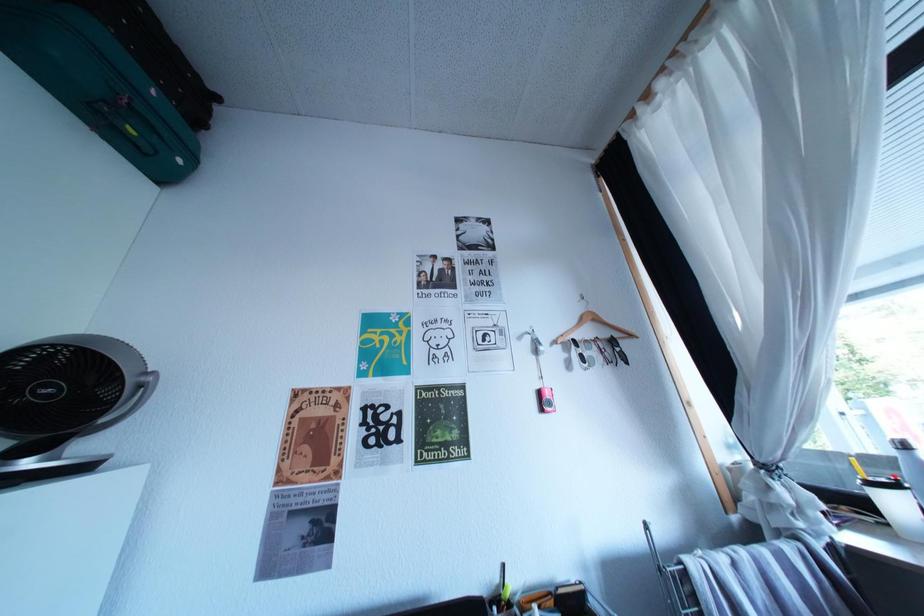
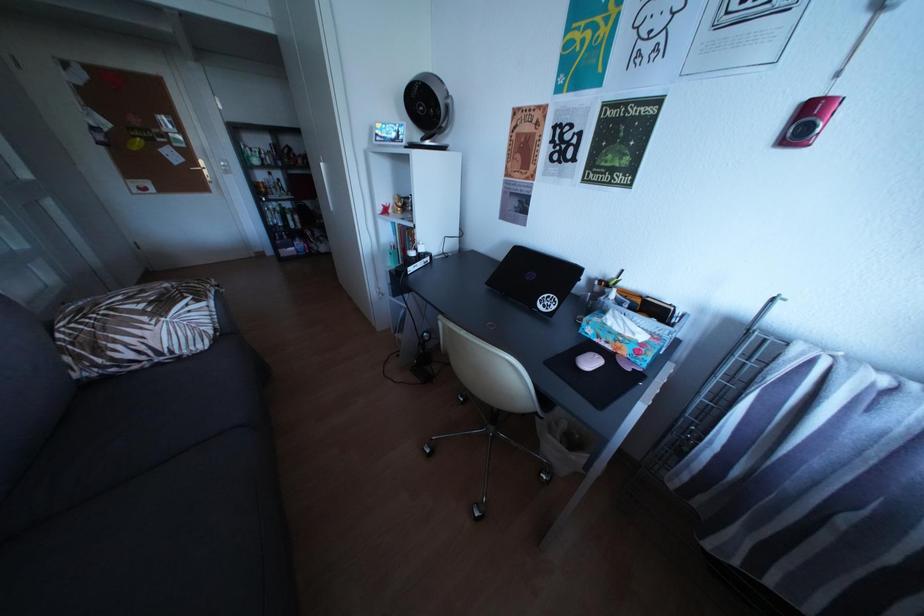
The images are taken continuously from a first-person perspective. In which direction is your viewpoint rotating?

The camera's rotation is toward left-down.